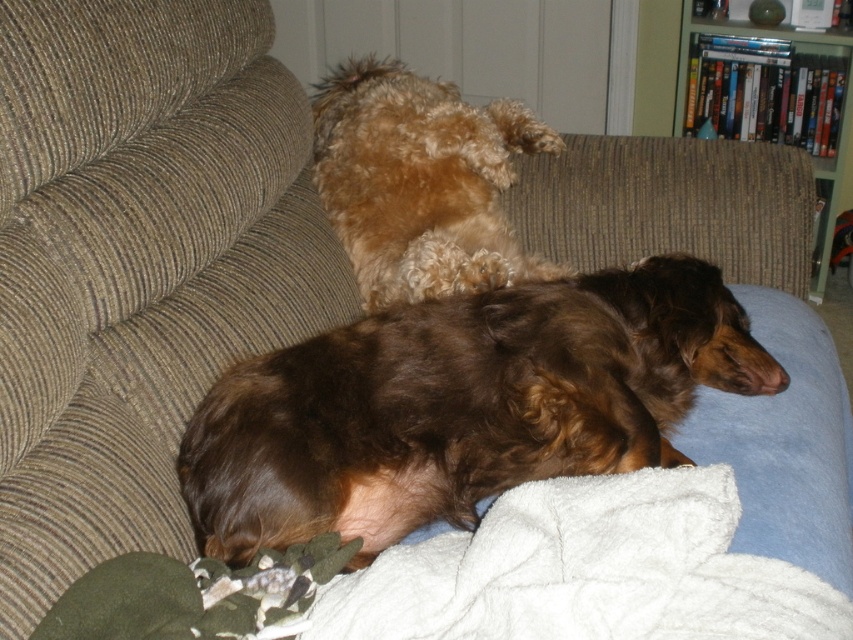
Question: Can you confirm if brown curly fur dog at center is positioned below wooden bookshelf at upper right?

Choices:
 (A) yes
 (B) no

Answer: (A)

Question: Which point is farther to the camera?

Choices:
 (A) (479, 385)
 (B) (384, 227)
 (C) (730, 32)
 (D) (698, 598)

Answer: (C)

Question: Observing the image, what is the correct spatial positioning of white soft blanket at lower center in reference to fuzzy brown dog at upper center?

Choices:
 (A) below
 (B) above

Answer: (A)

Question: Which is farther from the fuzzy brown dog at upper center?

Choices:
 (A) brown curly fur dog at center
 (B) white soft blanket at lower center

Answer: (B)

Question: Which point is farther to the camera?

Choices:
 (A) brown curly fur dog at center
 (B) fuzzy brown dog at upper center

Answer: (B)

Question: Can you confirm if brown curly fur dog at center is positioned to the right of wooden bookshelf at upper right?

Choices:
 (A) no
 (B) yes

Answer: (A)